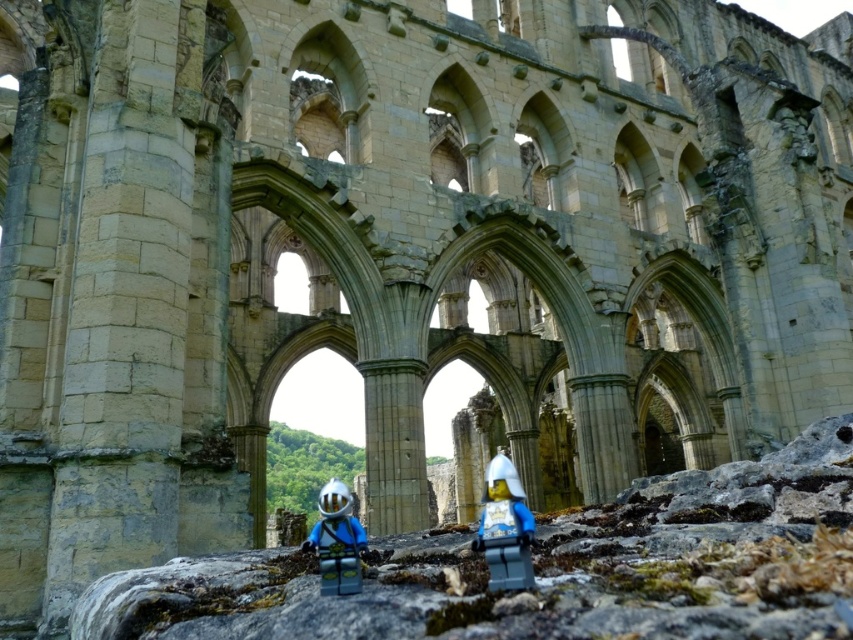
Question: Does smooth plastic helmet at center have a lesser width compared to matte blue plastic minifigure at center?

Choices:
 (A) no
 (B) yes

Answer: (B)

Question: Does smooth plastic helmet at center have a smaller size compared to matte blue plastic minifigure at center?

Choices:
 (A) no
 (B) yes

Answer: (B)

Question: Which point is farther to the camera?

Choices:
 (A) matte blue plastic minifigure at center
 (B) smooth plastic helmet at center

Answer: (A)

Question: Is smooth plastic helmet at center smaller than matte blue plastic minifigure at center?

Choices:
 (A) no
 (B) yes

Answer: (B)